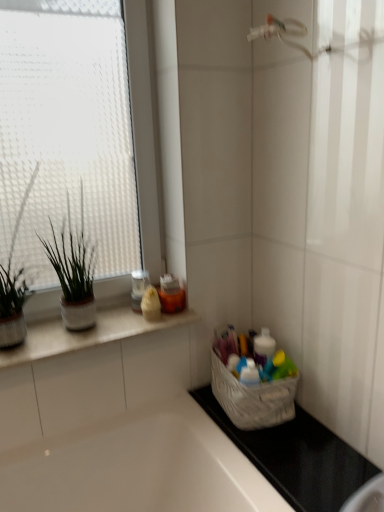
The height and width of the screenshot is (512, 384). I want to click on vacant space underneath green matte plant at left, which ranks as the 1th houseplant in right-to-left order (from a real-world perspective), so click(81, 329).